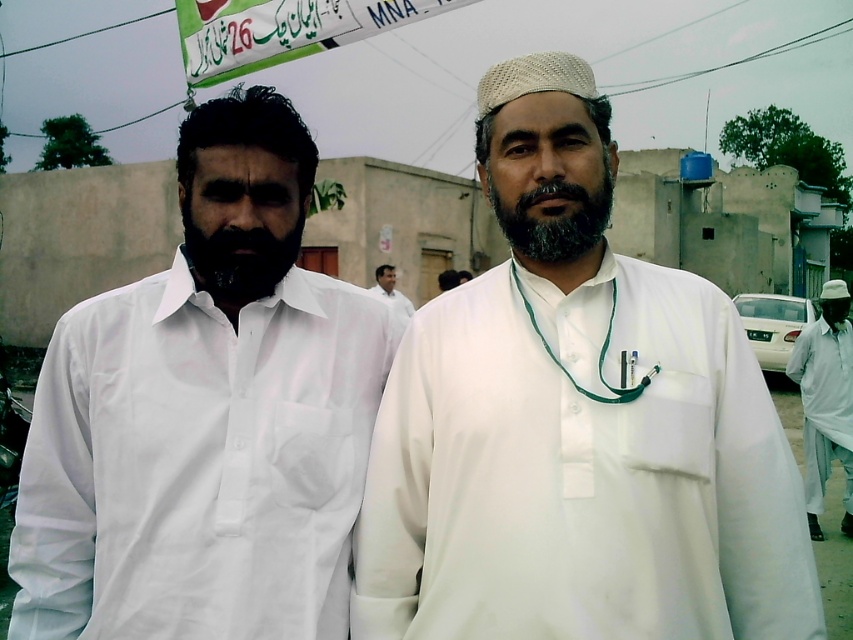
What do you see at coordinates (555, 218) in the screenshot? The width and height of the screenshot is (853, 640). I see `gray matte beard at center` at bounding box center [555, 218].

Can you confirm if gray matte beard at center is smaller than white cotton shirt at center?

Yes, gray matte beard at center is smaller than white cotton shirt at center.

Is point (598, 195) positioned in front of point (401, 323)?

Yes, point (598, 195) is closer to viewer.

Identify the location of gray matte beard at center. (555, 218).

Does white cotton robe at right have a smaller size compared to gray matte beard at center?

No, white cotton robe at right is not smaller than gray matte beard at center.

Is white cotton robe at right closer to the viewer compared to gray matte beard at center?

No, white cotton robe at right is behind gray matte beard at center.

What do you see at coordinates (824, 404) in the screenshot? This screenshot has height=640, width=853. I see `white cotton robe at right` at bounding box center [824, 404].

Find the location of a particular element. This screenshot has width=853, height=640. white cotton robe at right is located at coordinates click(824, 404).

Which of these two, white matte kameez at center or white cotton robe at right, stands shorter?

Standing shorter between the two is white cotton robe at right.

Does point (585, 566) lie in front of point (833, 355)?

Yes, point (585, 566) is closer to viewer.

The image size is (853, 640). In order to click on white matte kameez at center in this screenshot , I will do `click(576, 426)`.